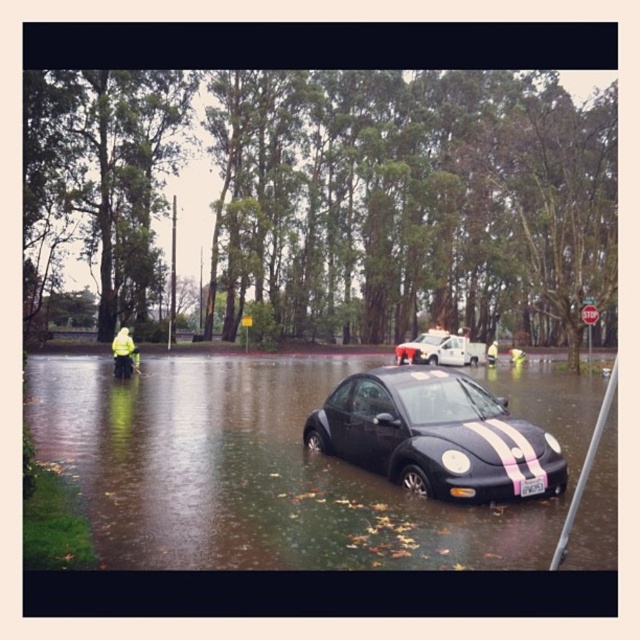
Question: Based on their relative distances, which object is farther from the yellow reflective jacket at lower left?

Choices:
 (A) black plastic license plate at center
 (B) black rubber water at center

Answer: (A)

Question: Does glossy black car at center have a larger size compared to yellow reflective jacket at center?

Choices:
 (A) no
 (B) yes

Answer: (A)

Question: Which point is farther to the camera?

Choices:
 (A) click(486, 360)
 (B) click(488, 436)
 (C) click(433, 340)

Answer: (A)

Question: Is the position of shiny black car at center more distant than that of glossy black car at center?

Choices:
 (A) yes
 (B) no

Answer: (B)

Question: Does shiny black car at center appear on the right side of glossy black car at center?

Choices:
 (A) yes
 (B) no

Answer: (B)

Question: Based on their relative distances, which object is farther from the yellow reflective jacket at center?

Choices:
 (A) shiny black car at center
 (B) glossy black car at center
 (C) black plastic license plate at center
 (D) black rubber water at center

Answer: (C)